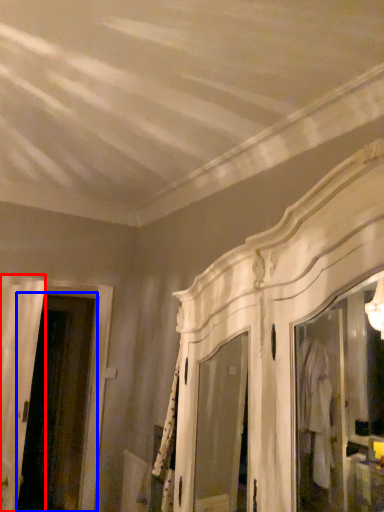
Question: Which object is closer to the camera taking this photo, door (highlighted by a red box) or screen door (highlighted by a blue box)?

Choices:
 (A) door
 (B) screen door

Answer: (A)